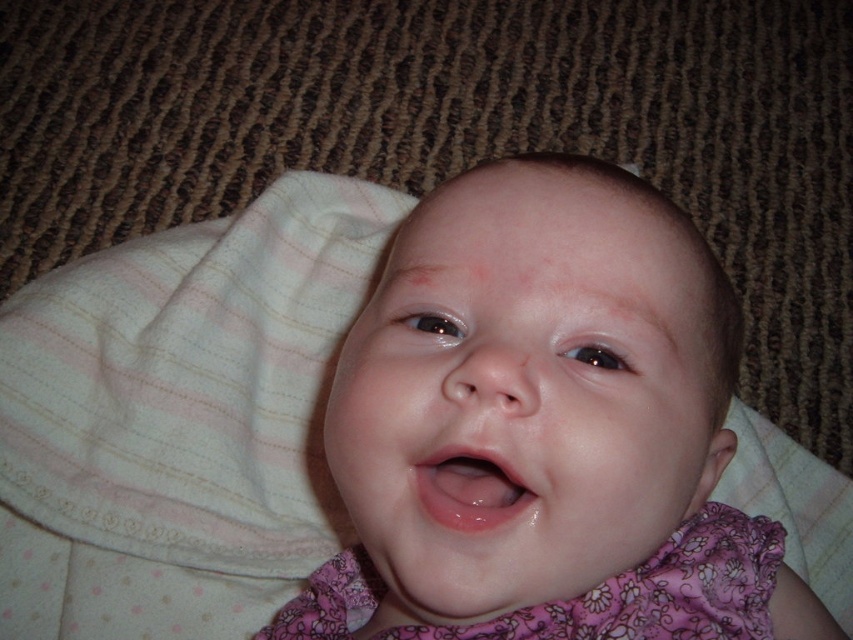
Between smooth skin baby at center and glossy pink lips at center, which one has more height?

smooth skin baby at center is taller.

Can you confirm if smooth skin baby at center is positioned below glossy pink lips at center?

No, smooth skin baby at center is not below glossy pink lips at center.

Between point (463, 268) and point (440, 512), which one is positioned behind?

The point (463, 268) is more distant.

This screenshot has height=640, width=853. In order to click on smooth skin baby at center in this screenshot , I will do `click(525, 394)`.

Can you confirm if white striped fabric at center is shorter than pink floral fabric dress at center?

No, white striped fabric at center is not shorter than pink floral fabric dress at center.

Can you confirm if white striped fabric at center is taller than pink floral fabric dress at center?

Yes, white striped fabric at center is taller than pink floral fabric dress at center.

Which is in front, point (219, 417) or point (701, 602)?

Point (701, 602)

Identify the location of white striped fabric at center. (180, 419).

Is white striped fabric at center positioned behind glossy pink lips at center?

Yes, it is.

Between white striped fabric at center and glossy pink lips at center, which one appears on the left side from the viewer's perspective?

white striped fabric at center

The height and width of the screenshot is (640, 853). Find the location of `white striped fabric at center`. white striped fabric at center is located at coordinates (180, 419).

Locate an element on the screen. white striped fabric at center is located at coordinates (180, 419).